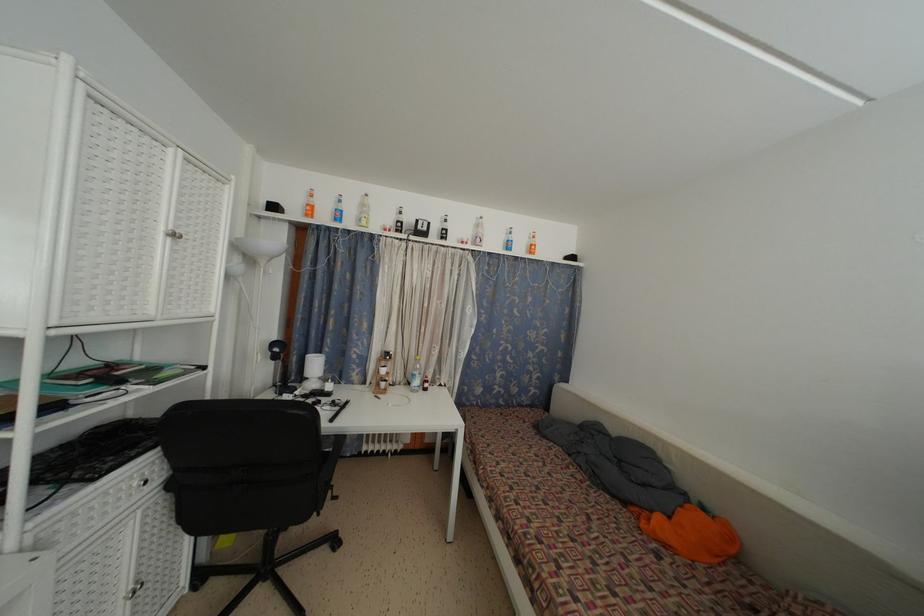
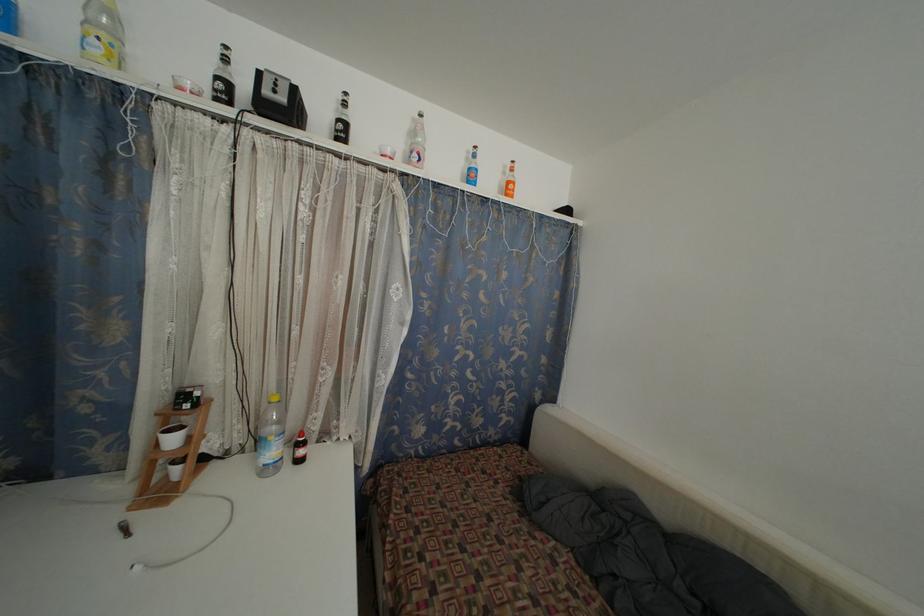
Locate, in the second image, the point that corresponds to point (429, 233) in the first image.

(286, 105)